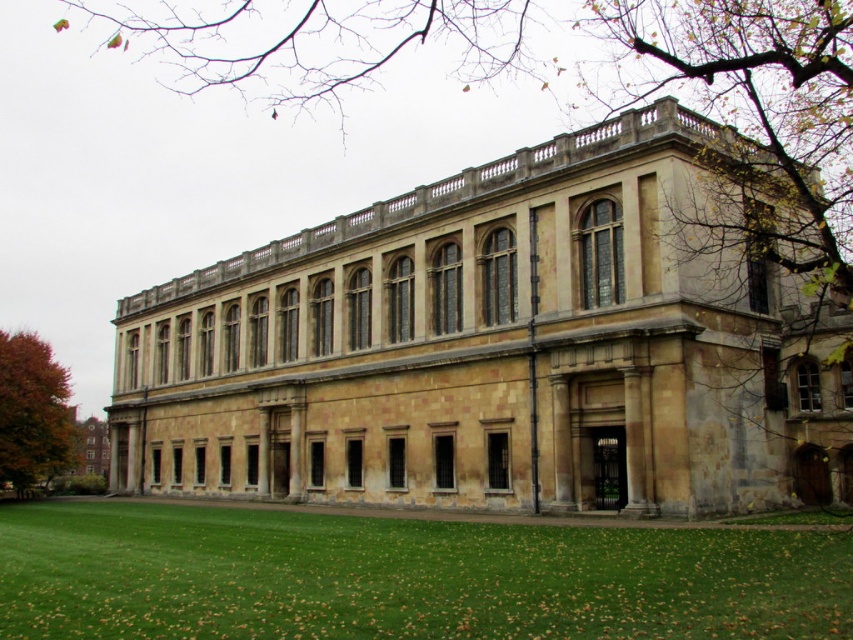
Question: Which object is the closest to the yellow stone building at center?

Choices:
 (A) green grass at lower center
 (B) orange leafy tree at lower left

Answer: (A)

Question: Is the position of yellow stone building at center more distant than that of green grass at lower center?

Choices:
 (A) yes
 (B) no

Answer: (A)

Question: Which point appears farthest from the camera in this image?

Choices:
 (A) (451, 548)
 (B) (676, 307)

Answer: (B)

Question: In this image, where is yellow stone building at center located relative to orange leafy tree at lower left?

Choices:
 (A) below
 (B) above

Answer: (B)

Question: Does green grass at lower center appear under orange leafy tree at lower left?

Choices:
 (A) no
 (B) yes

Answer: (B)

Question: Which of the following is the closest to the observer?

Choices:
 (A) (285, 442)
 (B) (440, 612)
 (C) (56, 432)

Answer: (B)